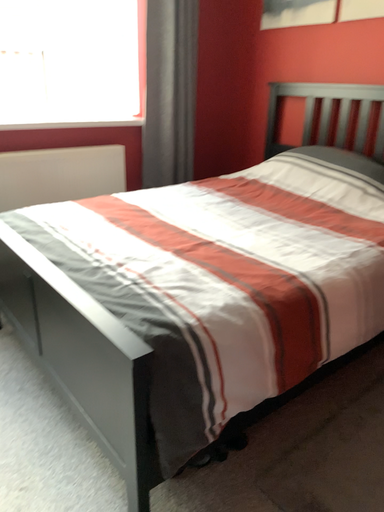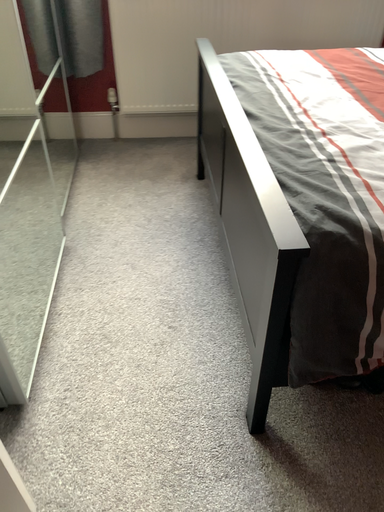
Question: Which way did the camera rotate in the video?

Choices:
 (A) rotated upward
 (B) rotated downward

Answer: (B)